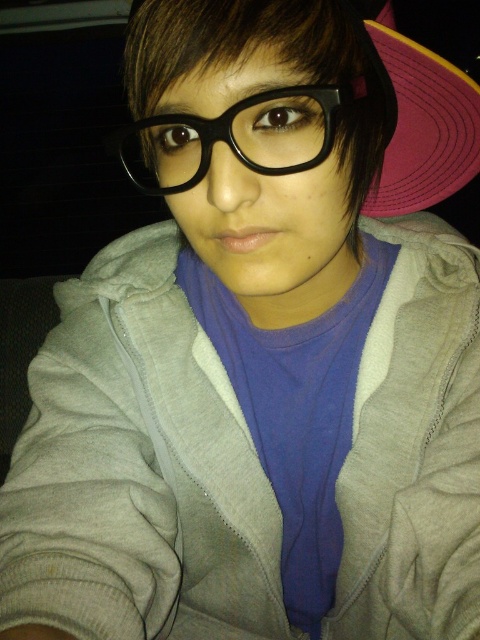
Between pink fabric baseball hat at upper right and black plastic glasses at center, which one is positioned higher?

pink fabric baseball hat at upper right is above.

Can you confirm if pink fabric baseball hat at upper right is positioned to the left of black plastic glasses at center?

In fact, pink fabric baseball hat at upper right is to the right of black plastic glasses at center.

Where is `pink fabric baseball hat at upper right`? pink fabric baseball hat at upper right is located at coordinates (414, 116).